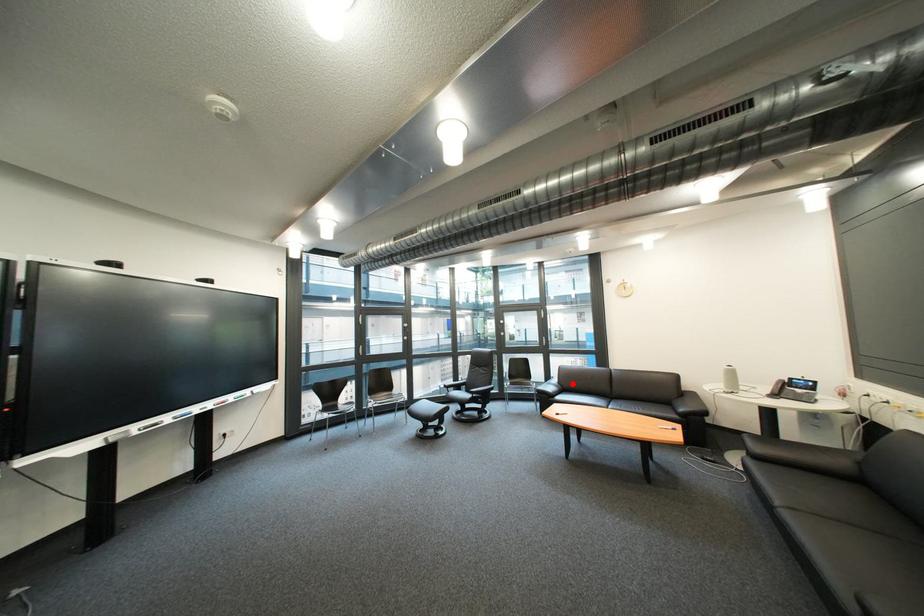
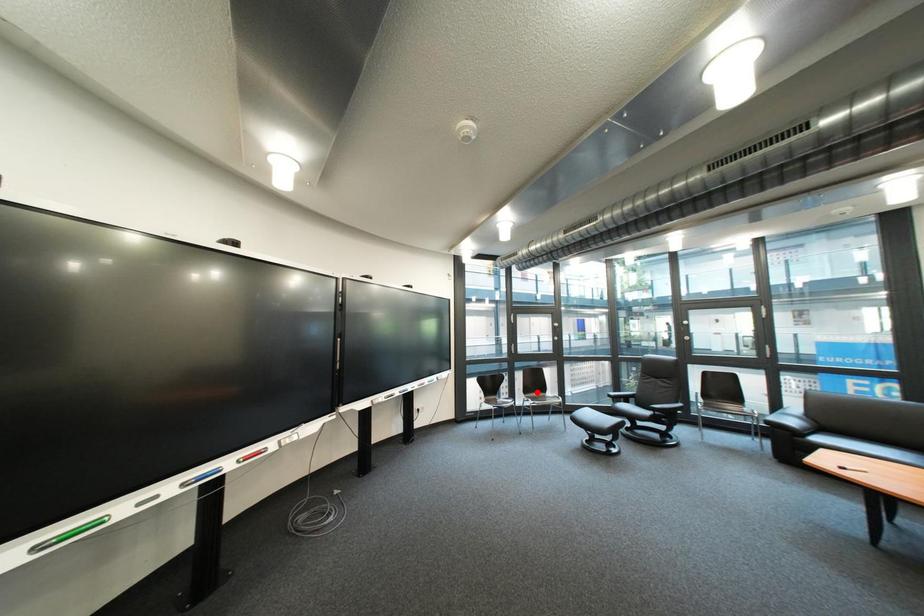
I am providing you with two images of the same scene from different viewpoints. A red point is marked on the first image and another point is marked on the second image. Does the point marked in image1 correspond to the same location as the one in image2?

No